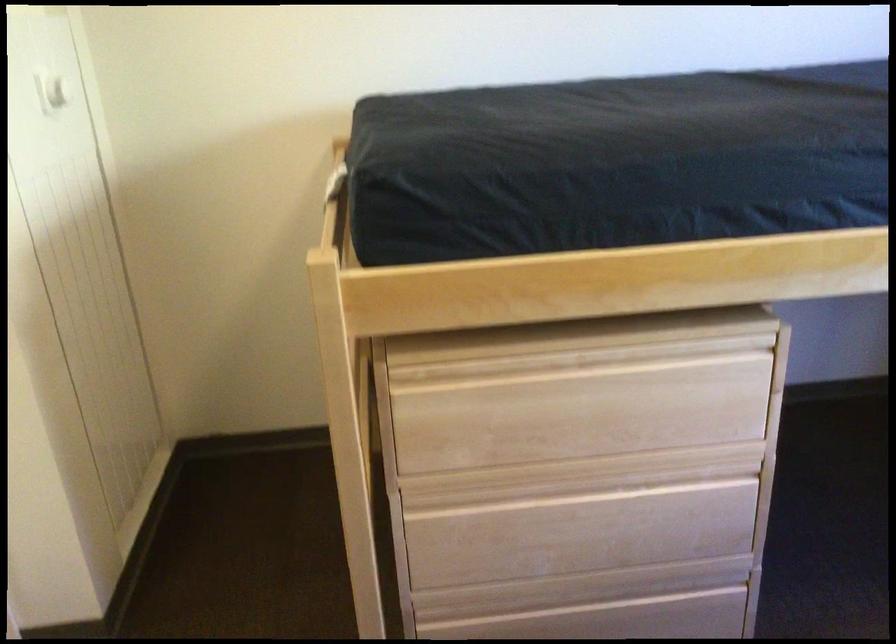
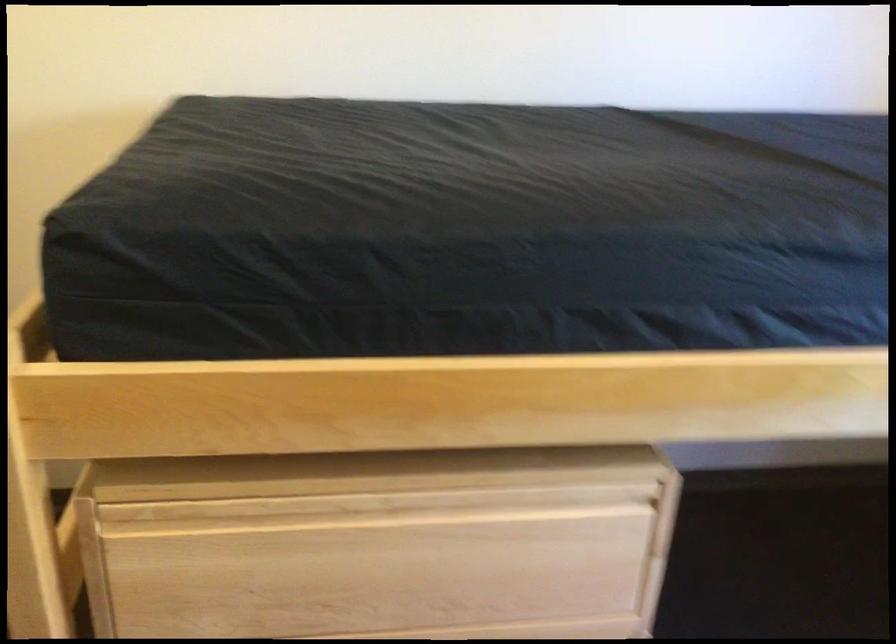
Question: The camera is either moving clockwise (left) or counter-clockwise (right) around the object. The first image is from the beginning of the video and the second image is from the end. Is the camera moving left or right when shooting the video?

Choices:
 (A) Left
 (B) Right

Answer: (A)